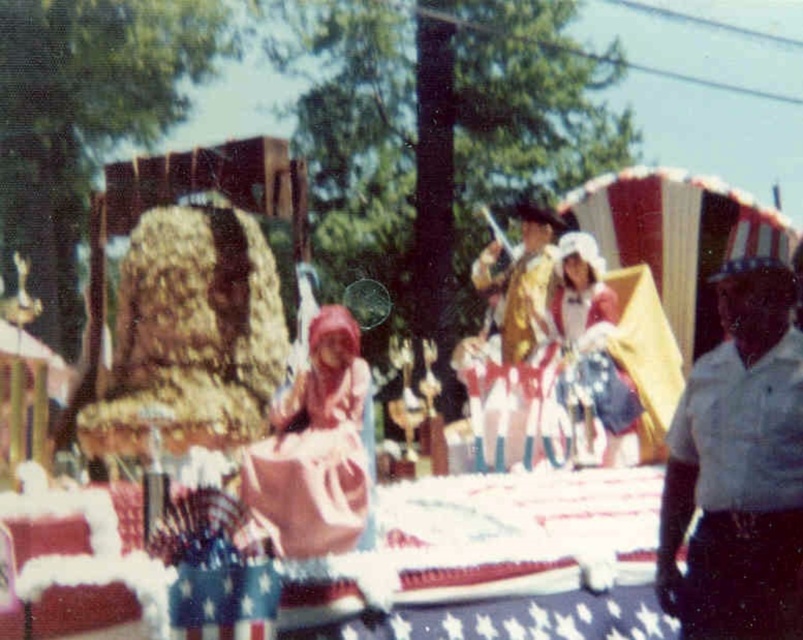
You are a photographer trying to capture the float in the parade scene. You notice two points marked on your camera screen at coordinates point (693, 566) and point (333, 412). Which point is nearer to your camera lens?

Point (693, 566) is closer to the camera than point (333, 412), so the photographer should focus on that point for a clearer shot.

You are attending a parade and notice two people on the float. One is wearing a white uniform at right and the other is in a white satin dress at center. Which person is positioned more to the right side of the float?

The white uniform at right is positioned more to the right side of the float compared to the white satin dress at center.

You are attending a parade and notice two performers on a float wearing the gold metallic uniform at center and the white satin dress at center. Which performer is standing closer to the front of the float?

The gold metallic uniform at center is positioned under the white satin dress at center, meaning the performer in the gold metallic uniform at center is closer to the front of the float.